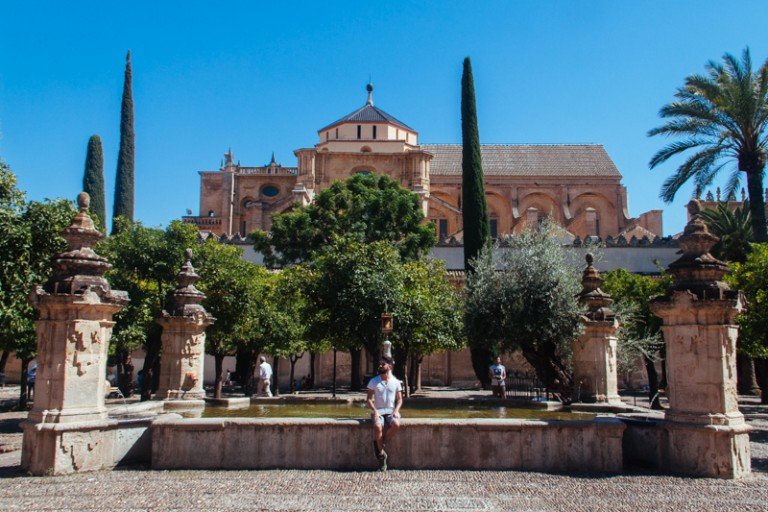
Image resolution: width=768 pixels, height=512 pixels. In order to click on pillars in this screenshot , I will do `click(84, 385)`, `click(186, 354)`, `click(598, 354)`, `click(697, 362)`.